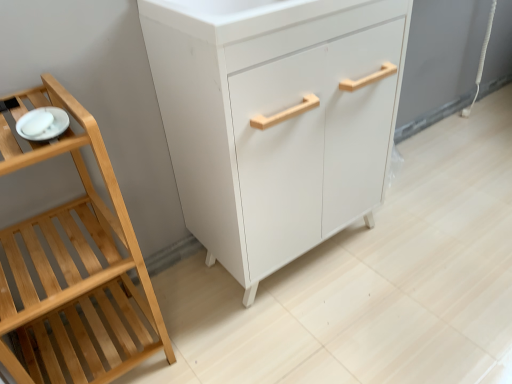
Question: Considering the relative sizes of white glossy plate at left and white matte cabinet at center in the image provided, is white glossy plate at left bigger than white matte cabinet at center?

Choices:
 (A) no
 (B) yes

Answer: (A)

Question: Are white glossy plate at left and white matte cabinet at center making contact?

Choices:
 (A) no
 (B) yes

Answer: (A)

Question: Considering the relative sizes of white glossy plate at left and white matte cabinet at center in the image provided, is white glossy plate at left wider than white matte cabinet at center?

Choices:
 (A) no
 (B) yes

Answer: (A)

Question: Considering the relative positions of white glossy plate at left and white matte cabinet at center in the image provided, is white glossy plate at left to the right of white matte cabinet at center from the viewer's perspective?

Choices:
 (A) yes
 (B) no

Answer: (B)

Question: Is white glossy plate at left taller than white matte cabinet at center?

Choices:
 (A) yes
 (B) no

Answer: (B)

Question: Is white glossy plate at left positioned behind white matte cabinet at center?

Choices:
 (A) yes
 (B) no

Answer: (B)

Question: Does white matte cabinet at center have a greater height compared to white glossy plate at left?

Choices:
 (A) no
 (B) yes

Answer: (B)

Question: From the image's perspective, would you say white matte cabinet at center is positioned over white glossy plate at left?

Choices:
 (A) no
 (B) yes

Answer: (B)

Question: Is white glossy plate at left at the back of white matte cabinet at center?

Choices:
 (A) yes
 (B) no

Answer: (B)

Question: Can we say white matte cabinet at center lies outside white glossy plate at left?

Choices:
 (A) no
 (B) yes

Answer: (B)

Question: From a real-world perspective, is white matte cabinet at center positioned under white glossy plate at left based on gravity?

Choices:
 (A) no
 (B) yes

Answer: (B)

Question: Is white matte cabinet at center wider than white glossy plate at left?

Choices:
 (A) no
 (B) yes

Answer: (B)

Question: Is white glossy plate at left facing towards natural wood shelf at left?

Choices:
 (A) yes
 (B) no

Answer: (A)